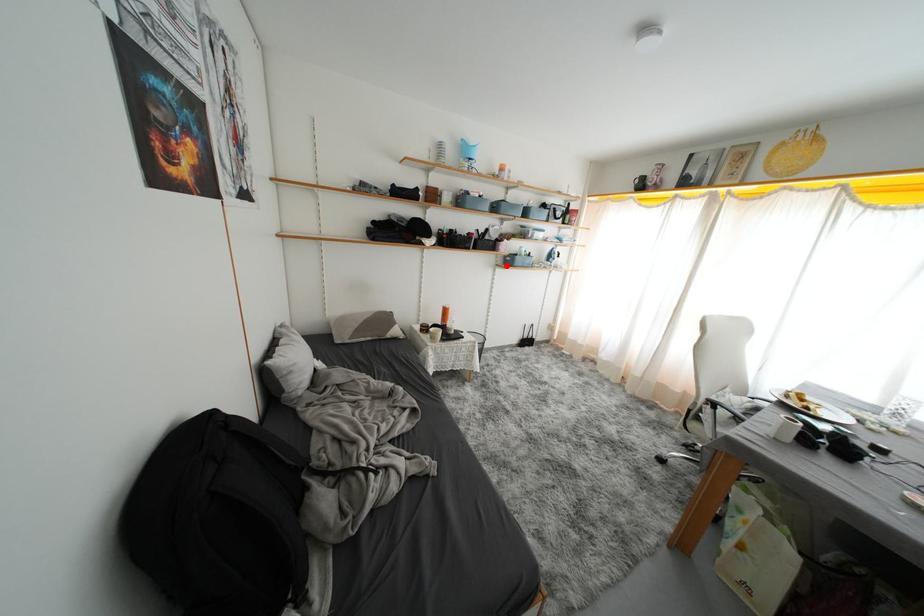
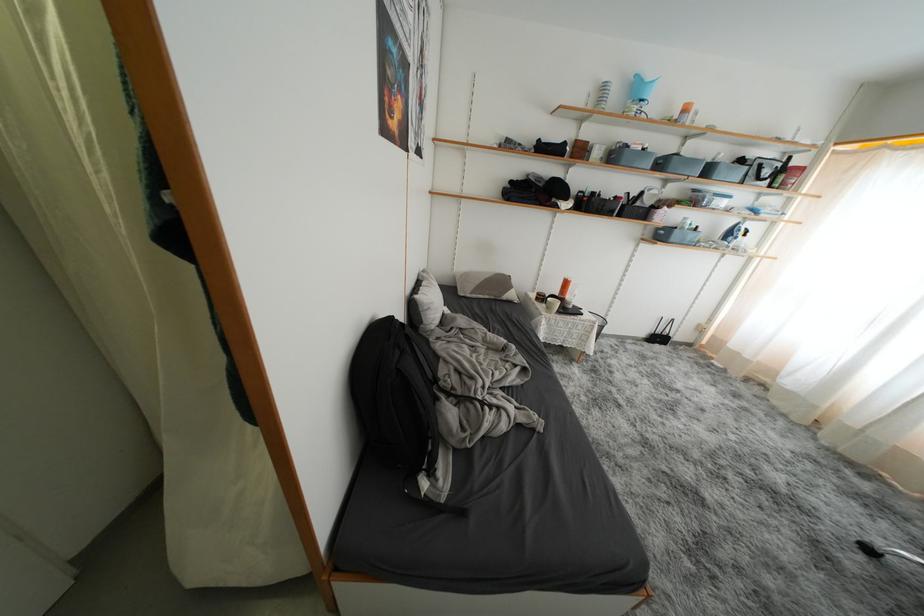
Find the pixel in the second image that matches the highlighted location in the first image.

(654, 238)